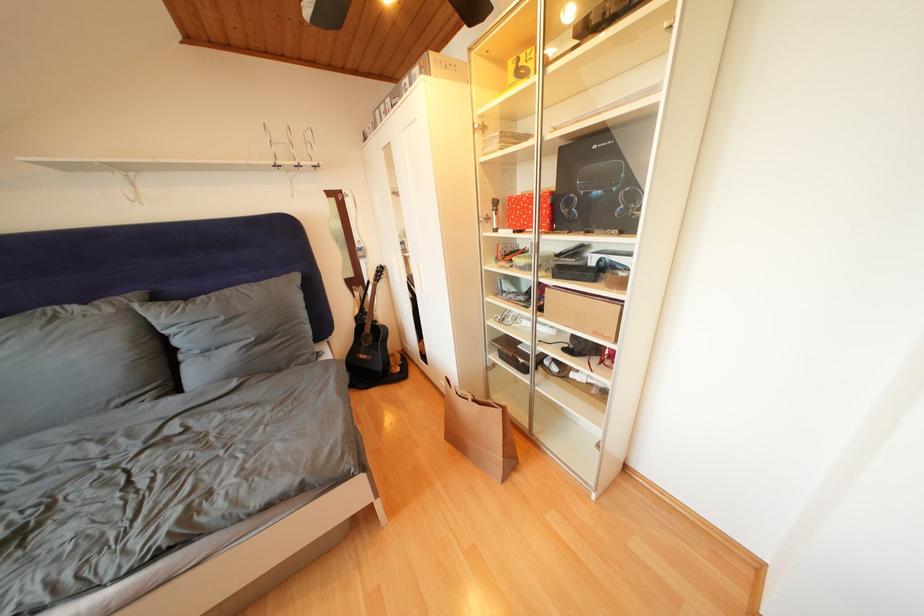
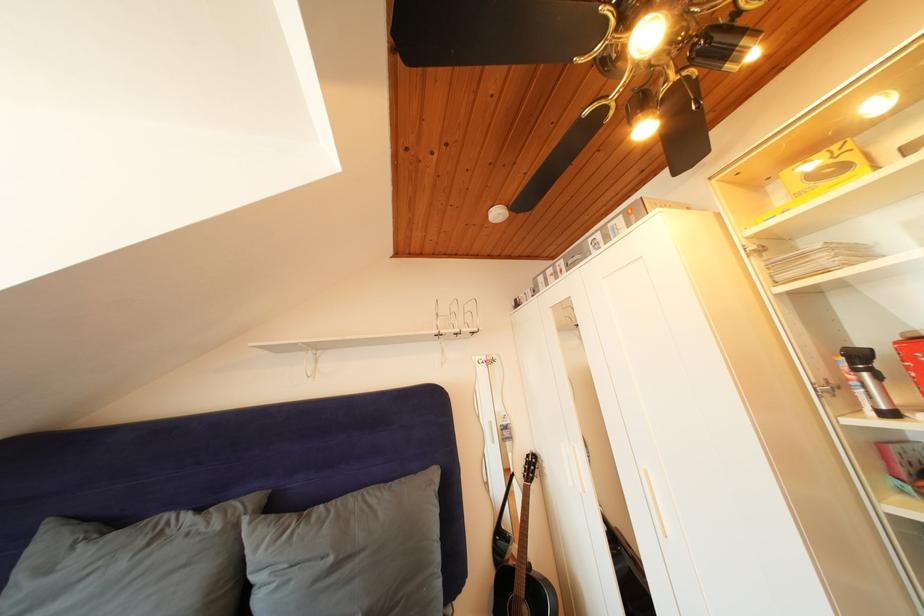
Where in the second image is the point corresponding to point (375, 334) from the first image?

(528, 592)